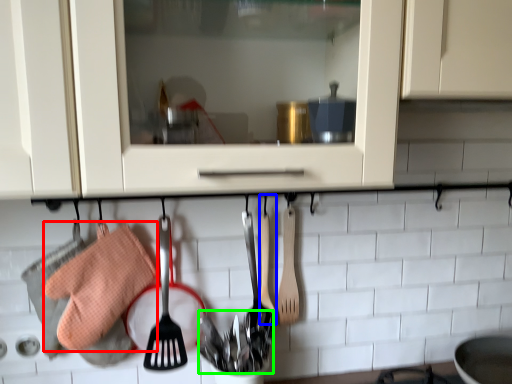
Question: Estimate the real-world distances between objects in this image. Which object is closer to material (highlighted by a red box), spatula (highlighted by a blue box) or silverware (highlighted by a green box)?

Choices:
 (A) spatula
 (B) silverware

Answer: (B)